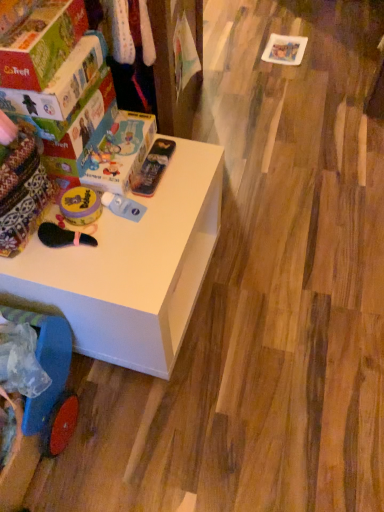
You are a GUI agent. You are given a task and a screenshot of the screen. Output one action in this format:
    pyautogui.click(x=<x>, y=<y>)
    Task: Click on the vacant area that lies to the right of white matte table at upper left
    
    Given the screenshot: What is the action you would take?
    pyautogui.click(x=273, y=290)